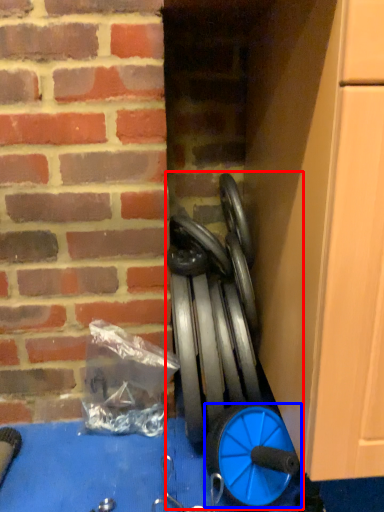
Question: Which object appears farthest to the camera in this image, sport equipment (highlighted by a red box) or wheel (highlighted by a blue box)?

Choices:
 (A) sport equipment
 (B) wheel

Answer: (A)